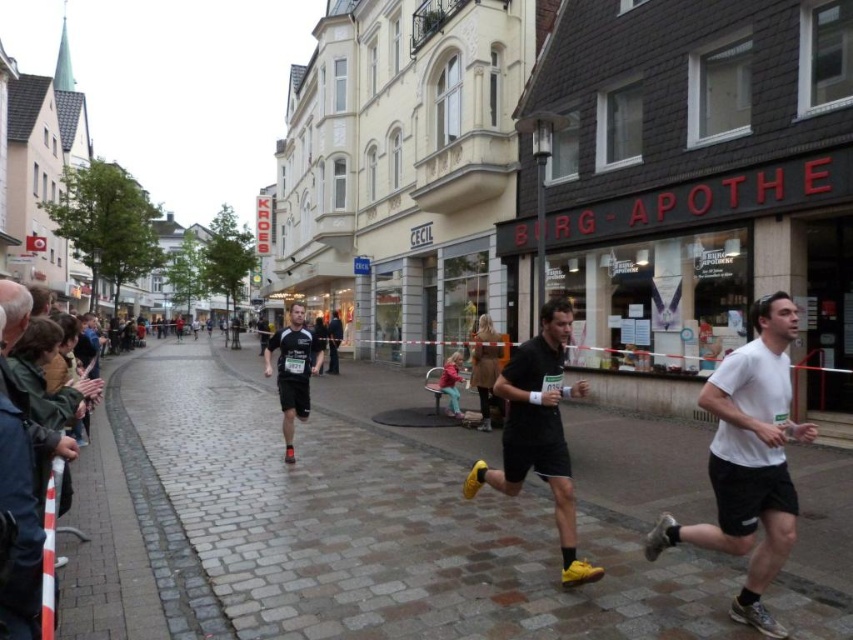
Question: Which of the following is the farthest from the observer?

Choices:
 (A) (9, 572)
 (B) (300, 308)

Answer: (B)

Question: Estimate the real-world distances between objects in this image. Which object is closer to the black matte running shoe at center?

Choices:
 (A) white matte shirt at right
 (B) black running shorts at center
 (C) matte black shorts at center
 (D) dark blue jacket at left

Answer: (B)

Question: Based on their relative distances, which object is nearer to the matte black shorts at center?

Choices:
 (A) black matte running shoe at center
 (B) black running shorts at center
 (C) dark blue jacket at left
 (D) white matte shirt at right

Answer: (D)

Question: Does dark blue jacket at left have a lesser width compared to black matte running shoe at center?

Choices:
 (A) yes
 (B) no

Answer: (A)

Question: Considering the relative positions of matte black shorts at center and dark blue jacket at left in the image provided, where is matte black shorts at center located with respect to dark blue jacket at left?

Choices:
 (A) above
 (B) below

Answer: (B)

Question: Can you confirm if matte black shorts at center is wider than black running shorts at center?

Choices:
 (A) yes
 (B) no

Answer: (B)